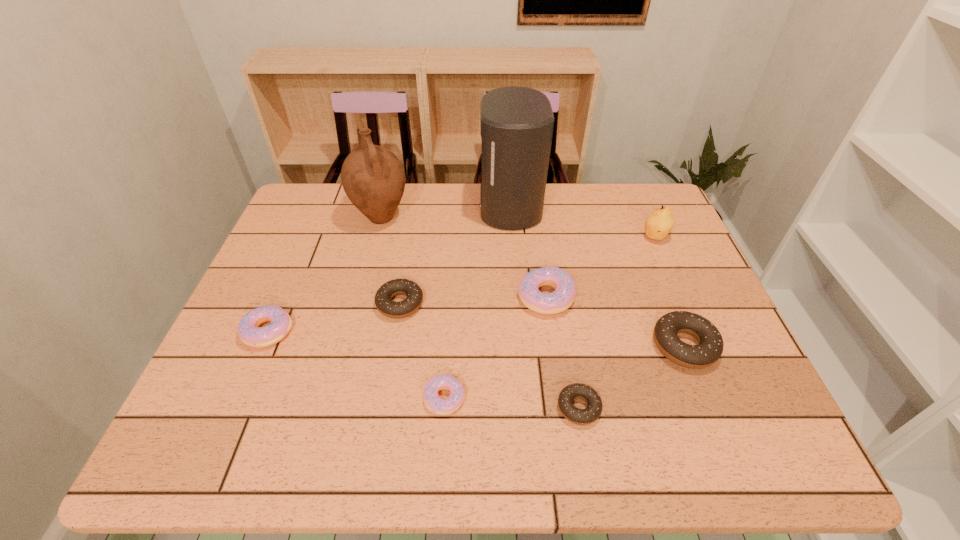
I want to click on free space located 0.230m on the back of the biggest pink doughnut, so click(x=536, y=224).

This screenshot has width=960, height=540. I want to click on free spot located on the left of the rightmost doughnut, so click(563, 346).

Where is `free space located on the front of the leftmost doughnut`? The height and width of the screenshot is (540, 960). free space located on the front of the leftmost doughnut is located at coordinates (220, 443).

What are the coordinates of `vacant space located 0.290m on the front of the second smallest brown doughnut` in the screenshot? It's located at (377, 435).

I want to click on blank space located 0.090m on the back of the second pink doughnut from right to left, so click(x=447, y=347).

Locate an element on the screen. The image size is (960, 540). free location located on the right of the second brown doughnut from left to right is located at coordinates (624, 408).

Where is `coffee maker that is at the far edge`? The height and width of the screenshot is (540, 960). coffee maker that is at the far edge is located at coordinates (516, 123).

Where is `pitcher at the far edge`? The image size is (960, 540). pitcher at the far edge is located at coordinates (373, 178).

Where is `pear at the far edge`? Image resolution: width=960 pixels, height=540 pixels. pear at the far edge is located at coordinates (659, 223).

Identify the location of object that is positioned at the near edge. This screenshot has width=960, height=540. (591, 413).